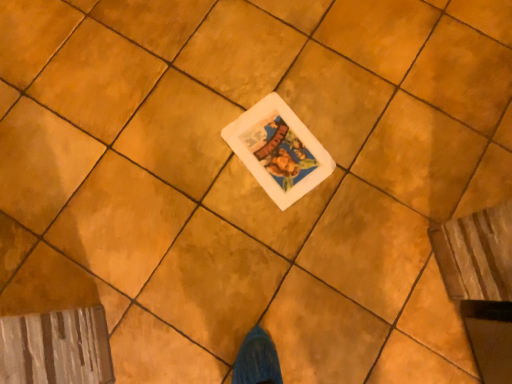
Locate an element on the screen. The image size is (512, 384). vacant space behind white matte comic book at center is located at coordinates (288, 78).